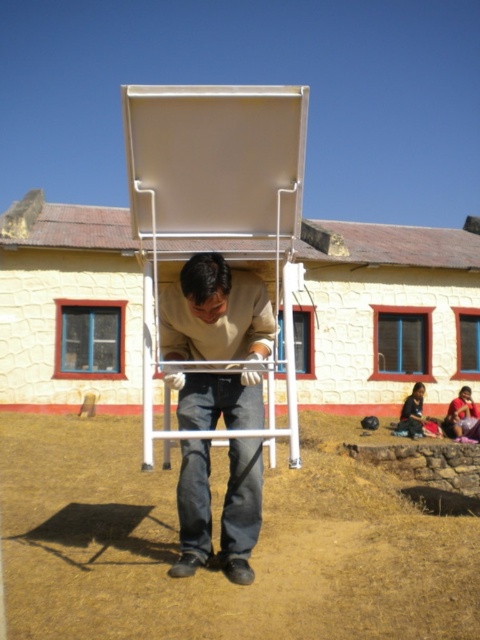
Which of these two, white matte easel at center or matte beige shirt at center, stands shorter?

white matte easel at center is shorter.

Is white matte easel at center positioned behind matte beige shirt at center?

No.

From the picture: Who is more forward, (238, 230) or (239, 422)?

Point (238, 230) is more forward.

The height and width of the screenshot is (640, 480). In order to click on white matte easel at center in this screenshot , I will do `click(216, 209)`.